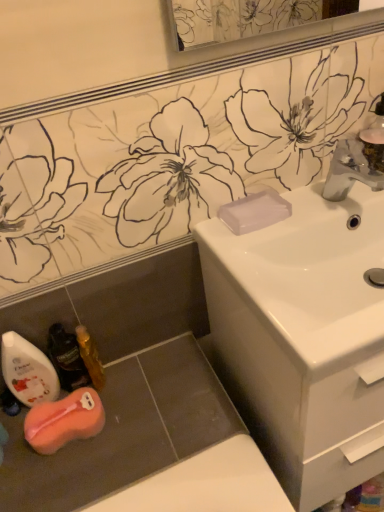
The image size is (384, 512). I want to click on free space to the right of transparent plastic soap at sink right, so click(x=317, y=203).